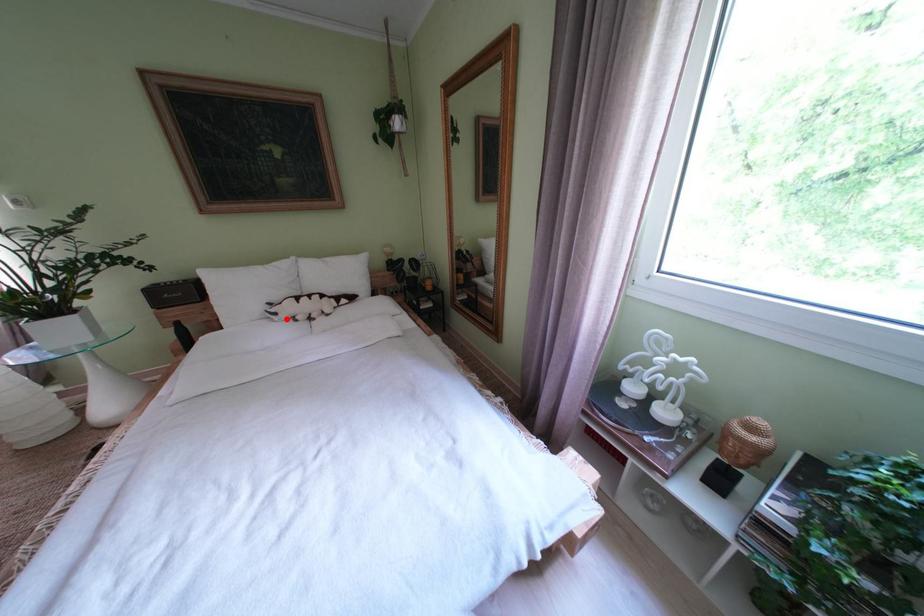
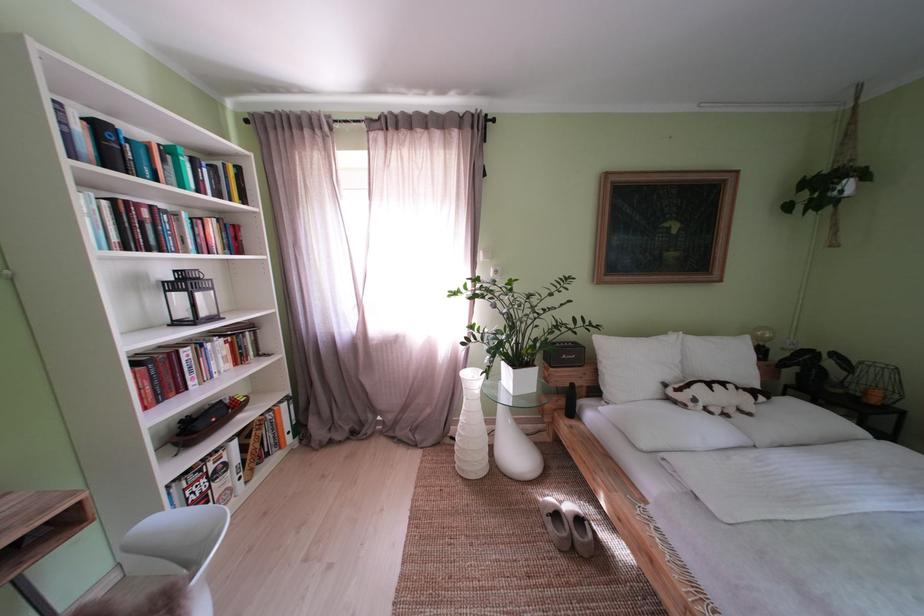
Question: I am providing you with two images of the same scene from different viewpoints. Image1 has a red point marked. In image2, the corresponding 3D location appears at what relative position? Reply with the corresponding letter.

Choices:
 (A) Closer
 (B) Farther

Answer: (B)